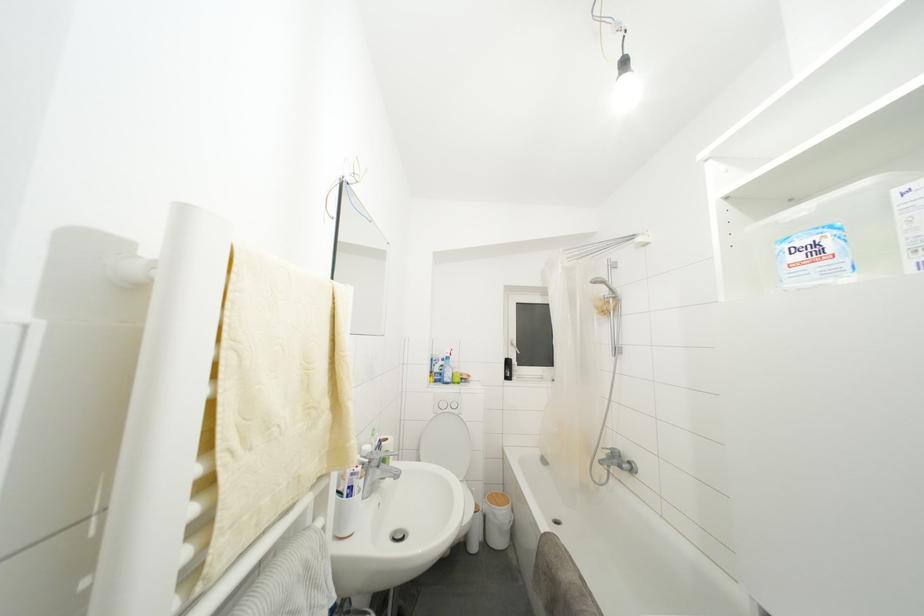
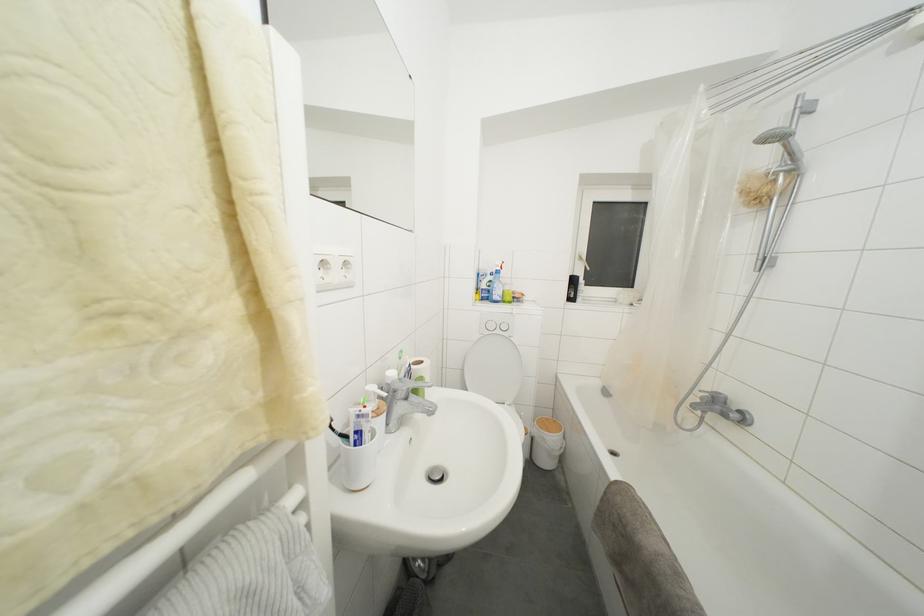
Find the pixel in the second image that matches (x=463, y=421) in the first image.

(513, 344)